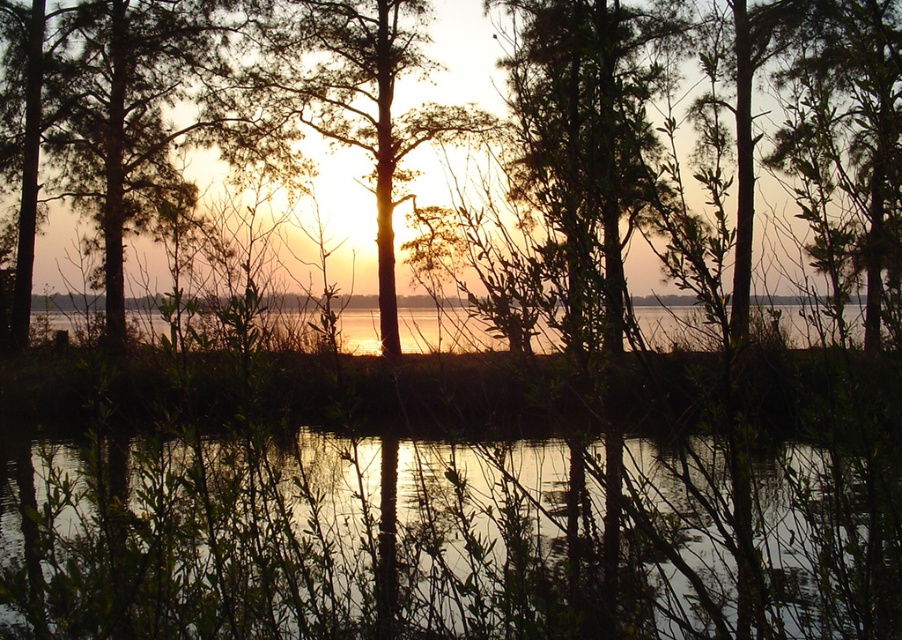
Question: Which point appears closest to the camera in this image?

Choices:
 (A) (591, 564)
 (B) (742, 227)

Answer: (A)

Question: Which is nearer to the green leafy tree at center?

Choices:
 (A) transparent water at center
 (B) silhouette bark tree at center

Answer: (B)

Question: Which point is closer to the camera?

Choices:
 (A) (551, 540)
 (B) (851, 12)

Answer: (A)

Question: Does transparent water at center appear under silhouette bark tree at center?

Choices:
 (A) no
 (B) yes

Answer: (B)

Question: Does transparent water at center have a lesser width compared to silhouette bark tree at center?

Choices:
 (A) yes
 (B) no

Answer: (B)

Question: Can you confirm if green leafy tree at center is thinner than silhouette bark tree at center?

Choices:
 (A) no
 (B) yes

Answer: (A)